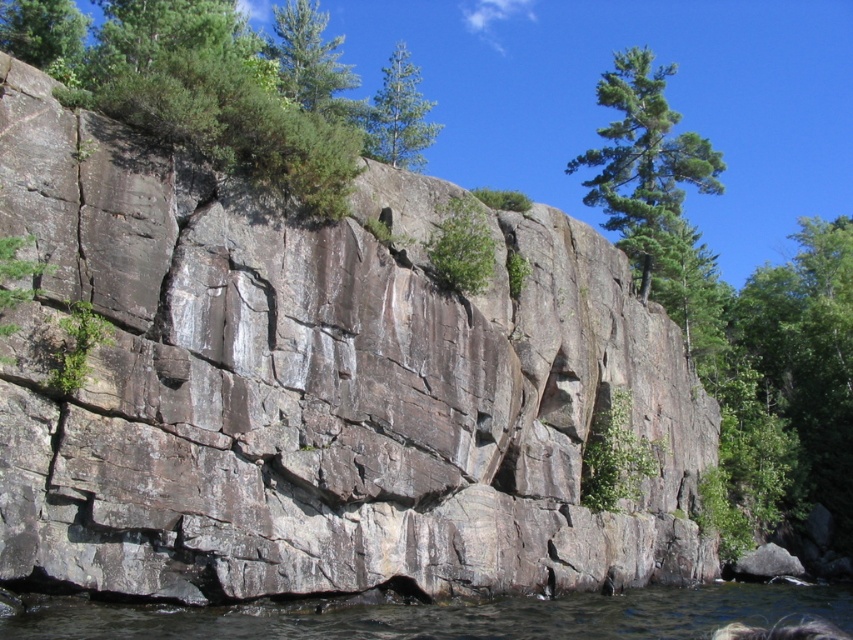
You are a hiker who wants to cross the clear water at lower center. There is a green leafy tree at upper center nearby. Can you use the tree to help you cross the water?

The clear water at lower center is larger in size than the green leafy tree at upper center, so the tree may not be large enough to provide support for crossing the water safely. It is recommended to find another method or route for crossing.